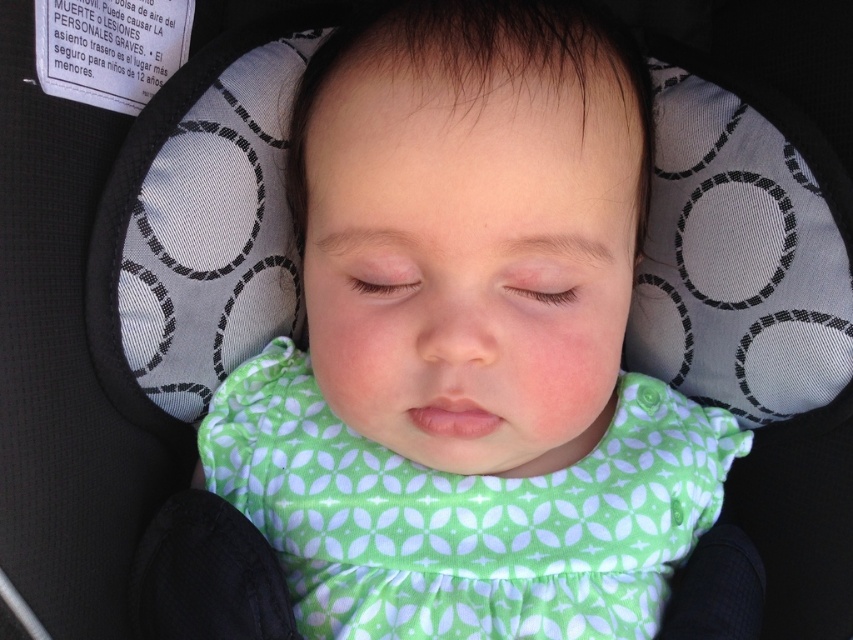
Question: In this image, where is green fabric bib at center located relative to green fabric dress at center?

Choices:
 (A) right
 (B) left

Answer: (B)

Question: Is the position of green fabric bib at center less distant than that of green fabric dress at center?

Choices:
 (A) yes
 (B) no

Answer: (A)

Question: Among these objects, which one is farthest from the camera?

Choices:
 (A) green fabric dress at center
 (B) green fabric bib at center

Answer: (A)

Question: Does green fabric bib at center lie behind green fabric dress at center?

Choices:
 (A) no
 (B) yes

Answer: (A)

Question: Among these points, which one is nearest to the camera?

Choices:
 (A) (260, 355)
 (B) (288, 429)

Answer: (B)

Question: Which point is closer to the camera taking this photo?

Choices:
 (A) (265, 493)
 (B) (625, 618)

Answer: (B)